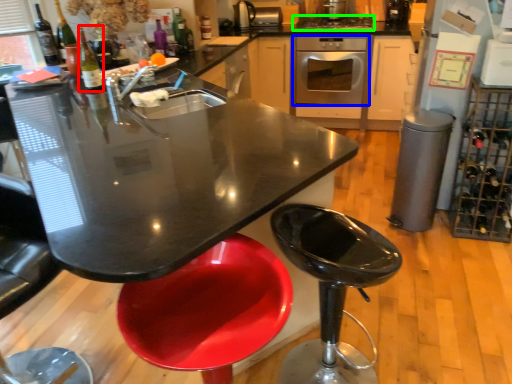
Question: Which object is the farthest from bottle (highlighted by a red box)? Choose among these: home appliance (highlighted by a blue box) or kitchen appliance (highlighted by a green box).

Choices:
 (A) home appliance
 (B) kitchen appliance

Answer: (A)